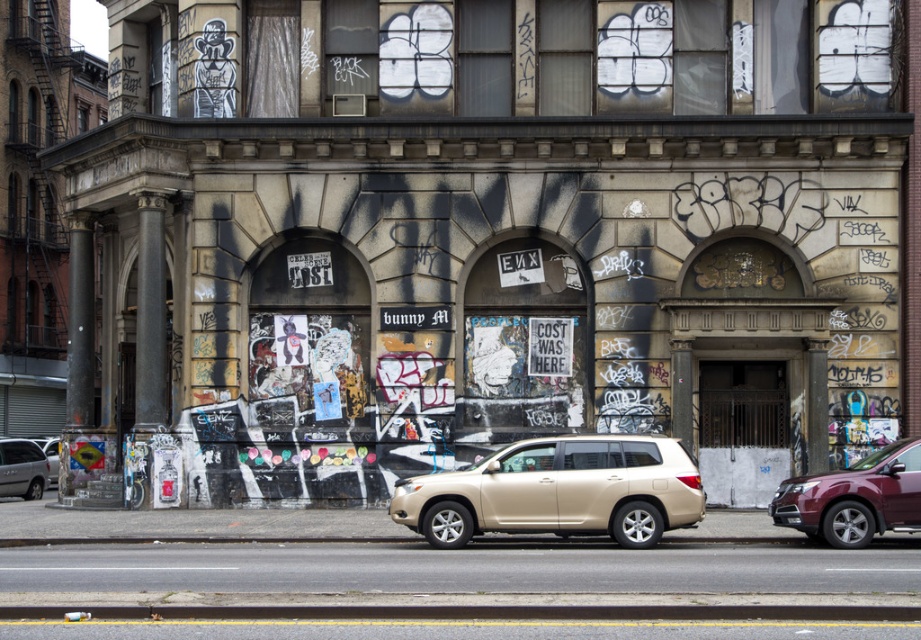
Question: Is maroon metallic suv at right below gold metallic suv at center?

Choices:
 (A) no
 (B) yes

Answer: (A)

Question: From the image, what is the correct spatial relationship of gold matte suv at center in relation to gold metallic suv at center?

Choices:
 (A) left
 (B) right

Answer: (B)

Question: Is gold matte suv at center bigger than gold metallic suv at center?

Choices:
 (A) no
 (B) yes

Answer: (B)

Question: Which of the following is the farthest from the observer?

Choices:
 (A) (496, 458)
 (B) (22, 490)

Answer: (B)

Question: Which object is the farthest from the gold metallic suv at center?

Choices:
 (A) gold matte suv at center
 (B) maroon metallic suv at right

Answer: (B)

Question: Which of the following is the farthest from the observer?

Choices:
 (A) (39, 493)
 (B) (815, 512)

Answer: (A)